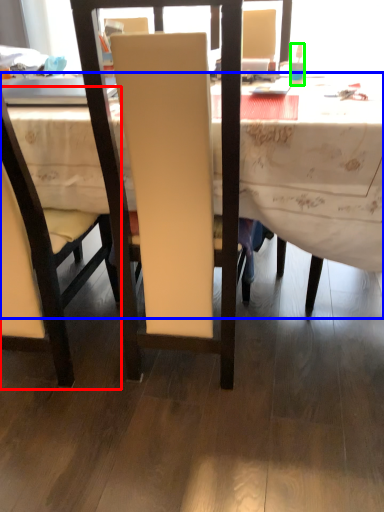
Question: Which object is positioned farthest from chair (highlighted by a red box)? Select from desk (highlighted by a blue box) and bottle (highlighted by a green box).

Choices:
 (A) desk
 (B) bottle

Answer: (B)